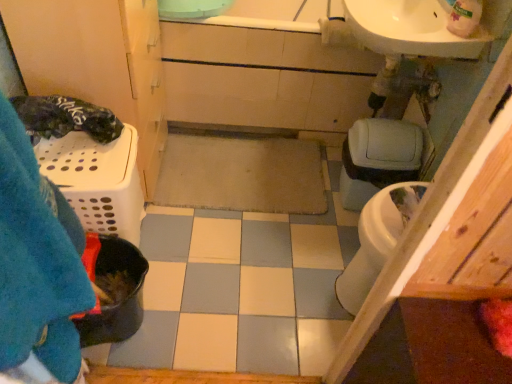
Question: Considering the positions of blue fuzzy blanket at left and white glossy sink at upper right in the image, is blue fuzzy blanket at left taller or shorter than white glossy sink at upper right?

Choices:
 (A) tall
 (B) short

Answer: (A)

Question: Would you say blue fuzzy blanket at left is to the left or to the right of white glossy sink at upper right in the picture?

Choices:
 (A) right
 (B) left

Answer: (B)

Question: Which object is positioned closest to the white plastic laundry basket at left?

Choices:
 (A) matte gray toilet bowl at right
 (B) blue fuzzy blanket at left
 (C) white glossy sink at upper right

Answer: (C)

Question: Which object is positioned farthest from the blue fuzzy blanket at left?

Choices:
 (A) white plastic laundry basket at left
 (B) white glossy sink at upper right
 (C) matte gray toilet bowl at right

Answer: (C)